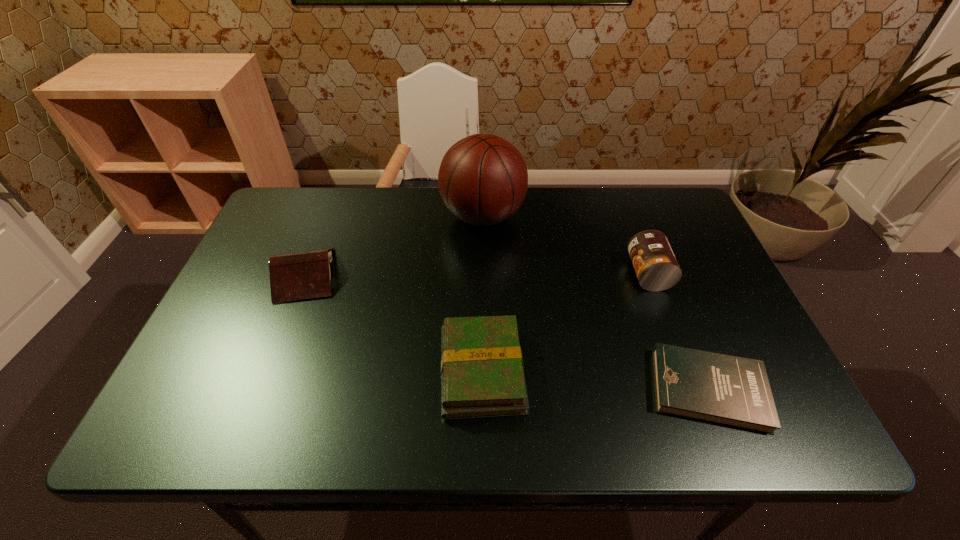
This screenshot has height=540, width=960. Find the location of `the farthest object`. the farthest object is located at coordinates (483, 179).

Find the location of `the tallest object`. the tallest object is located at coordinates (483, 179).

The image size is (960, 540). In order to click on the second tallest object in this screenshot , I will do `click(656, 267)`.

This screenshot has width=960, height=540. In order to click on the leftmost object in this screenshot , I will do 303,275.

I want to click on the farthest book, so click(x=303, y=275).

The width and height of the screenshot is (960, 540). What are the coordinates of `the second book from left to right` in the screenshot? It's located at (482, 374).

Find the location of `the shortest object`. the shortest object is located at coordinates (733, 391).

Image resolution: width=960 pixels, height=540 pixels. Find the location of `the rightmost book`. the rightmost book is located at coordinates [x=733, y=391].

Locate an element on the screen. This screenshot has height=540, width=960. free space located 0.390m on the front of the farthest object is located at coordinates (484, 361).

Where is `free space located on the front label of the fourth shortest object`? free space located on the front label of the fourth shortest object is located at coordinates (477, 274).